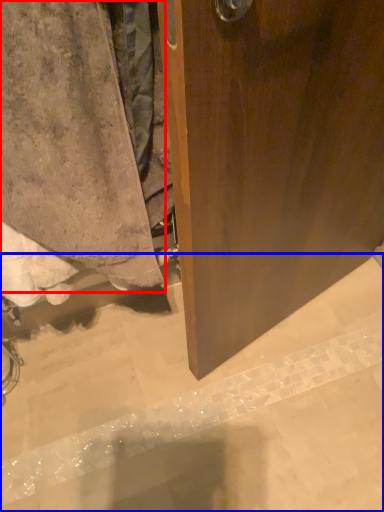
Question: Among these objects, which one is nearest to the camera, towel (highlighted by a red box) or concrete (highlighted by a blue box)?

Choices:
 (A) towel
 (B) concrete

Answer: (A)